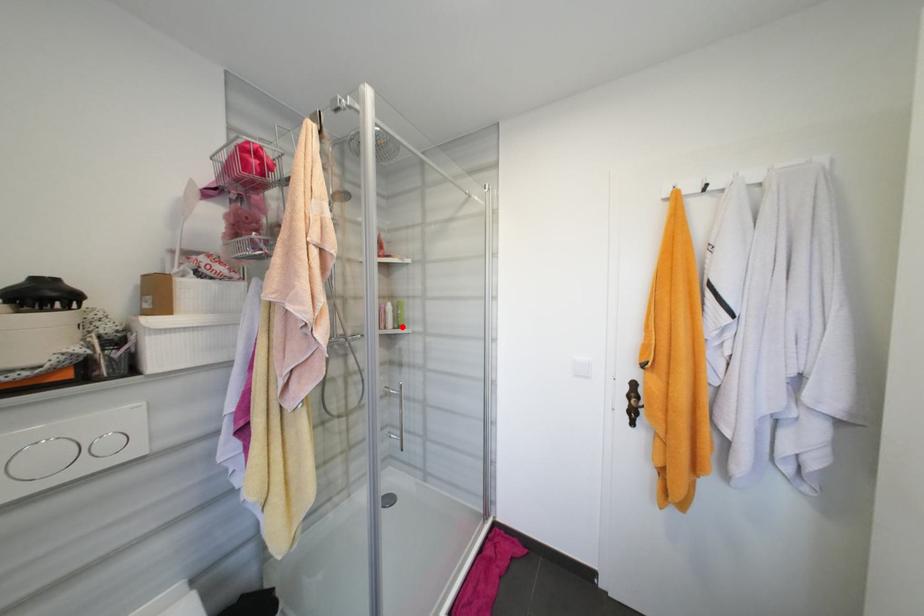
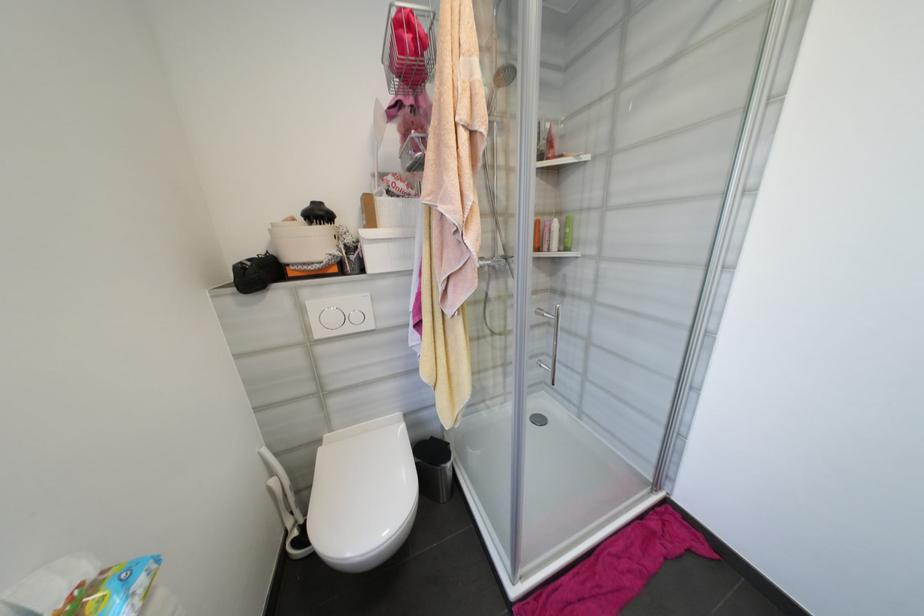
Find the pixel in the second image that matches the highlighted location in the first image.

(567, 249)